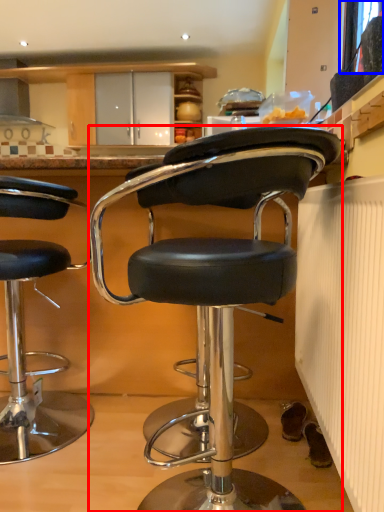
Question: Which of the following is the closest to the observer, chair (highlighted by a red box) or window screen (highlighted by a blue box)?

Choices:
 (A) chair
 (B) window screen

Answer: (A)